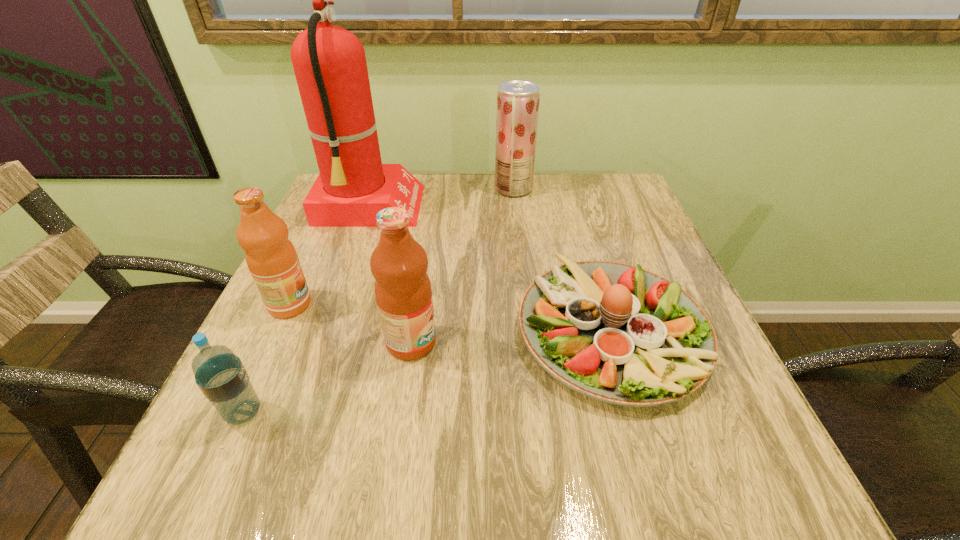
You are a GUI agent. You are given a task and a screenshot of the screen. Output one action in this format:
    pyautogui.click(x=<x>, y=<y>)
    Task: Click on the blank region between the tallest object and the second farthest fruit juice
    This screenshot has width=960, height=540.
    Given the screenshot: What is the action you would take?
    pyautogui.click(x=329, y=256)

You are a GUI agent. You are given a task and a screenshot of the screen. Output one action in this format:
    pyautogui.click(x=<x>, y=<y>)
    Task: Click on the vacant area that lies between the second fruit juice from left to right and the shortest object
    The width and height of the screenshot is (960, 540).
    Given the screenshot: What is the action you would take?
    pyautogui.click(x=511, y=336)

Locate which object is the closest to the farthest fruit juice. Please provide its 2D coordinates. Your answer should be formatted as a tuple, i.e. [(x, y)], where the tuple contains the x and y coordinates of a point satisfying the conditions above.

[(329, 62)]

Where is `the third closest object to the second fruit juice from right to left`? The height and width of the screenshot is (540, 960). the third closest object to the second fruit juice from right to left is located at coordinates (221, 376).

Choose which fruit juice is the third nearest neighbor to the shortest object. Please provide its 2D coordinates. Your answer should be formatted as a tuple, i.e. [(x, y)], where the tuple contains the x and y coordinates of a point satisfying the conditions above.

[(272, 260)]

I want to click on fruit juice that is the closest to the leftmost fruit juice, so click(403, 293).

The width and height of the screenshot is (960, 540). Identify the location of vacant region that satisfies the following two spatial constraints: 1. on the front-facing side of the tallest object; 2. on the right side of the shortest object. tap(326, 330).

I want to click on free space that satisfies the following two spatial constraints: 1. on the label side of the water bottle; 2. on the right side of the leftmost fruit juice, so click(x=240, y=413).

What are the coordinates of `free space that satisfies the following two spatial constraints: 1. on the label side of the leftmost fruit juice; 2. on the right side of the fifth tallest object` in the screenshot? It's located at (240, 413).